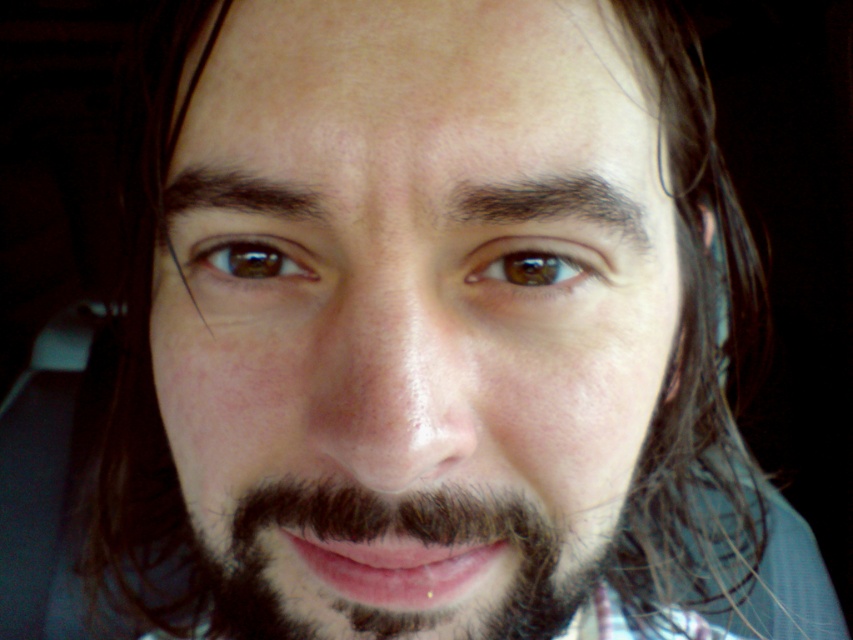
Between dark brown fuzzy beard at lower center and brown matte eye at center, which one appears on the left side from the viewer's perspective?

From the viewer's perspective, dark brown fuzzy beard at lower center appears more on the left side.

The image size is (853, 640). What do you see at coordinates (393, 566) in the screenshot?
I see `dark brown fuzzy beard at lower center` at bounding box center [393, 566].

Locate an element on the screen. The width and height of the screenshot is (853, 640). dark brown fuzzy beard at lower center is located at coordinates (393, 566).

Does point (213, 554) come farther from viewer compared to point (529, 515)?

Yes, it is.

Can you confirm if smooth skin face at center is positioned below dark brown fuzzy beard at lower center?

Actually, smooth skin face at center is above dark brown fuzzy beard at lower center.

Is point (329, 397) positioned before point (521, 545)?

Yes, it is in front of point (521, 545).

At what (x,y) coordinates should I click in order to perform the action: click on smooth skin face at center. Please return your answer as a coordinate pair (x, y). Looking at the image, I should click on (413, 310).

Can you confirm if smooth skin face at center is positioned below brown matte eye at center?

Correct, smooth skin face at center is located below brown matte eye at center.

Can you confirm if smooth skin face at center is positioned to the right of brown matte eye at center?

In fact, smooth skin face at center is to the left of brown matte eye at center.

Image resolution: width=853 pixels, height=640 pixels. What do you see at coordinates (413, 310) in the screenshot?
I see `smooth skin face at center` at bounding box center [413, 310].

At what (x,y) coordinates should I click in order to perform the action: click on smooth skin face at center. Please return your answer as a coordinate pair (x, y). The width and height of the screenshot is (853, 640). Looking at the image, I should click on (413, 310).